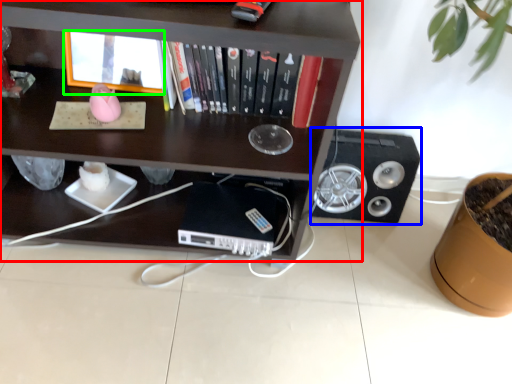
Question: Estimate the real-world distances between objects in this image. Which object is closer to shelf (highlighted by a red box), speaker (highlighted by a blue box) or shelf (highlighted by a green box)?

Choices:
 (A) speaker
 (B) shelf

Answer: (B)